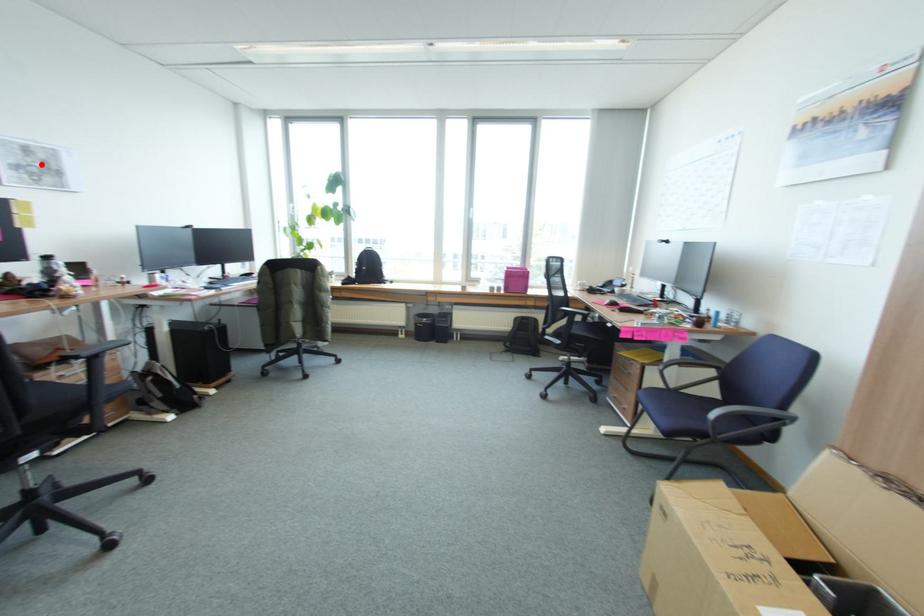
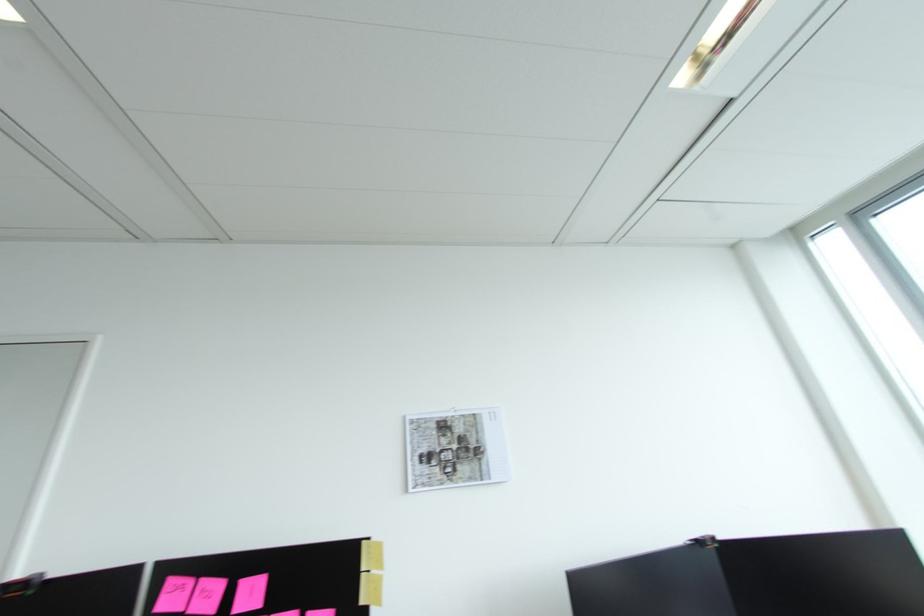
The point at the highlighted location is marked in the first image. Where is the corresponding point in the second image?

(459, 446)